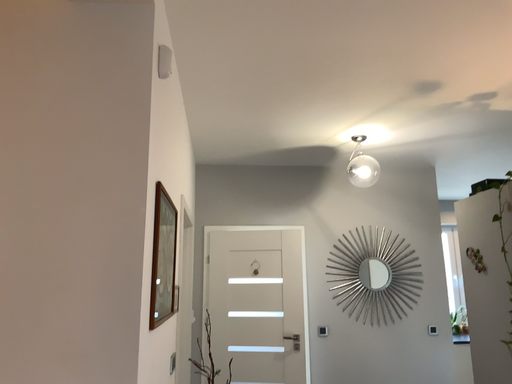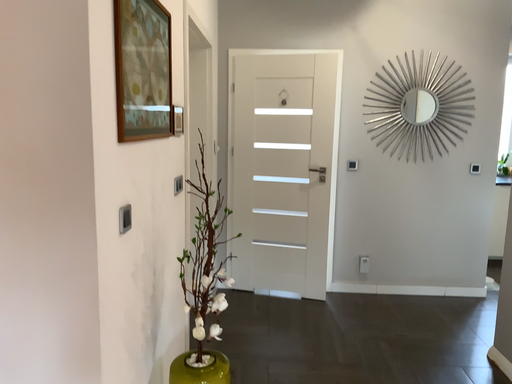
Question: How did the camera likely rotate when shooting the video?

Choices:
 (A) rotated upward
 (B) rotated downward

Answer: (B)